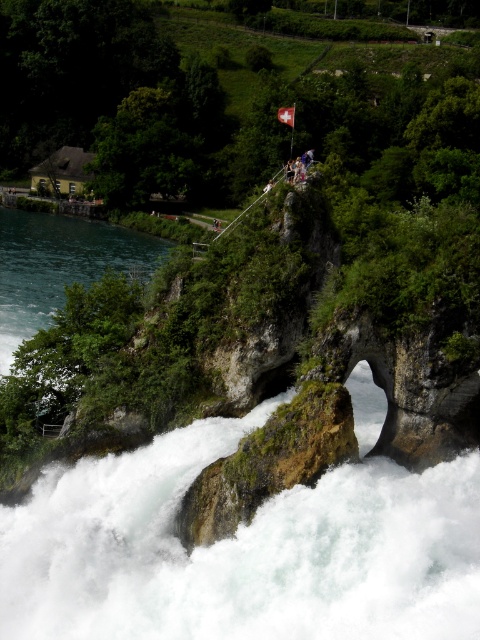
You are standing at the point marked as point [60,266]. What do you see immediately around you?

You see greenish blue water at left immediately around you at point [60,266].

You are a hiker standing at the base of the waterfall. You notice a white frothy water at center and a white fabric flag at center. Which object is closer to you?

The white frothy water at center is closer to you because it is positioned at the center of the waterfall, while the white fabric flag at center is further away, as they are 82.62 feet apart.

Consider the image. You are a hiker who wants to take a photo of the white frothy water at center and the white fabric flag at center. Which one should you focus on first if you want to capture both in one frame?

The white frothy water at center is positioned on the left side of white fabric flag at center, so you should focus on the white frothy water at center first to ensure both are in the frame.